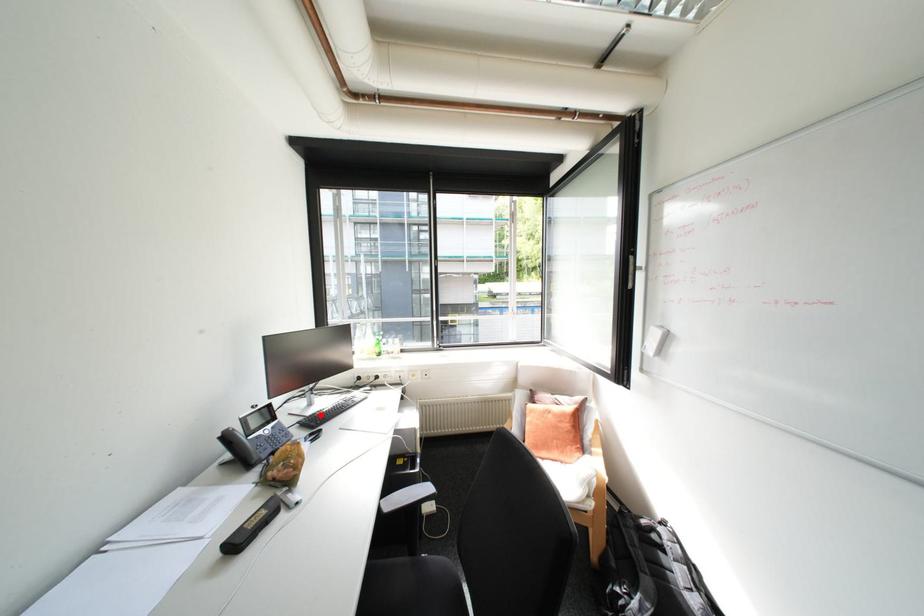
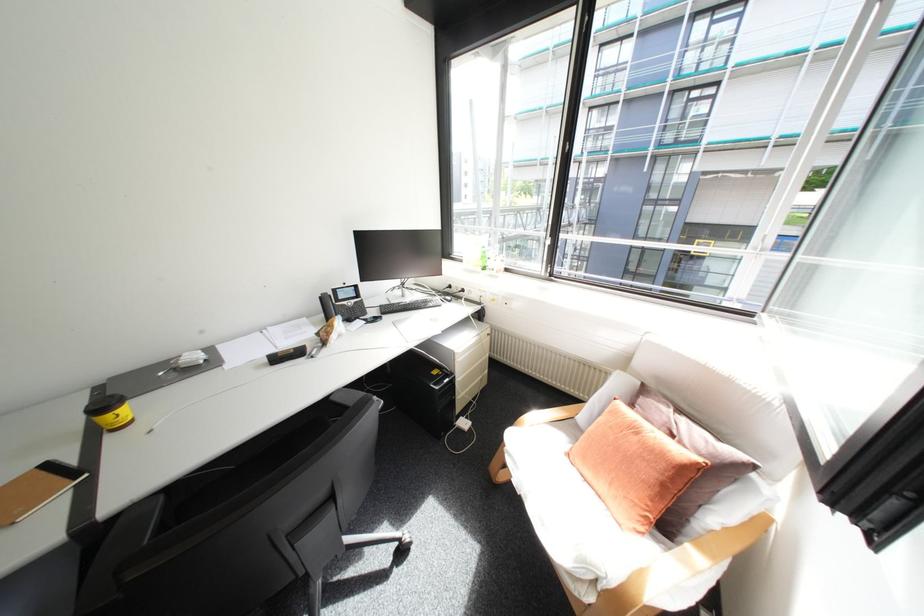
Locate, in the second image, the point that corresponds to the highlighted location in the first image.

(403, 304)